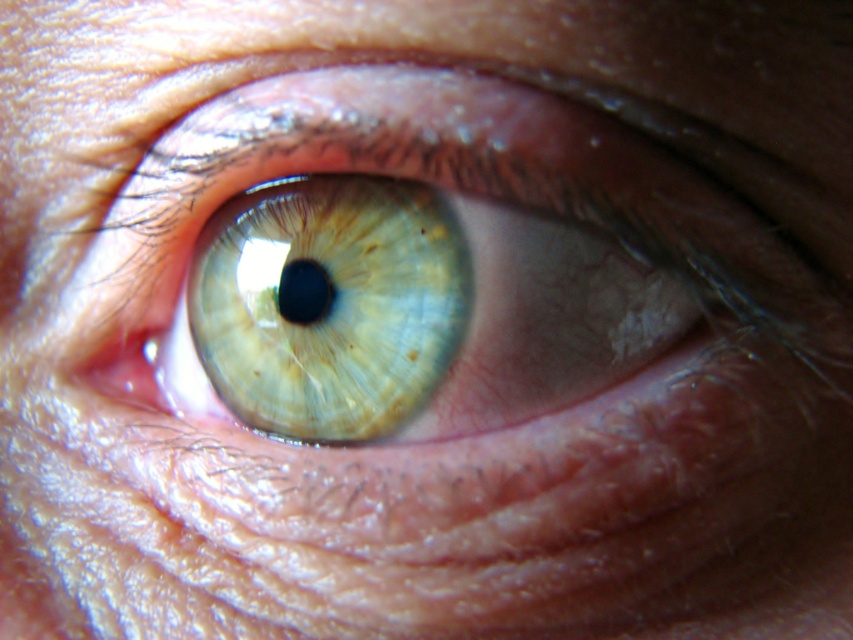
You are a photographer adjusting the focus on your camera. You notice two points in the image of the eye, one at point (376, 403) and the other at point (280, 280). Which point should you focus on to ensure it appears sharp in the final photo?

Answer: You should focus on point (376, 403) because it is closer to the camera than point (280, 280), so it will be in focus when the camera is set to that distance.